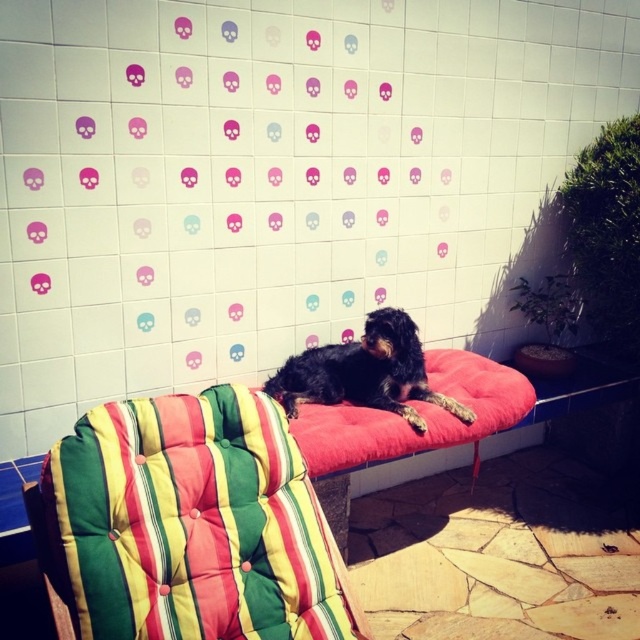
Based on the photo, between striped fabric cushion at center and black fur dog at center, which one has more height?

striped fabric cushion at center is taller.

Does striped fabric cushion at center appear on the right side of black fur dog at center?

Incorrect, striped fabric cushion at center is not on the right side of black fur dog at center.

Is point (60, 448) more distant than point (387, 404)?

No, it is not.

In order to click on striped fabric cushion at center in this screenshot , I will do `click(189, 524)`.